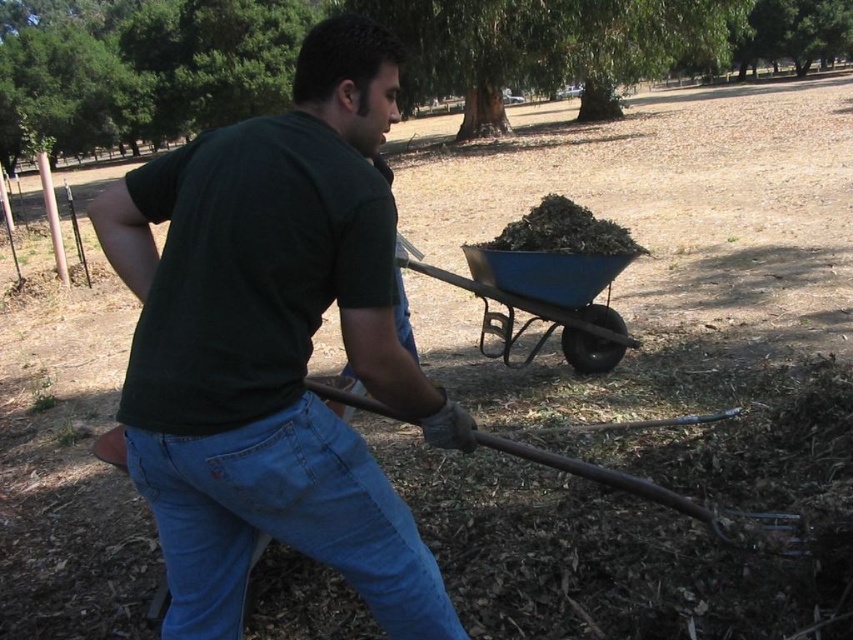
Which is above, denim at left or rusty metal shovel at lower center?

rusty metal shovel at lower center is above.

Identify the location of denim at left. (283, 520).

Is dark green t-shirt at center below rusty metal shovel at lower center?

No, dark green t-shirt at center is not below rusty metal shovel at lower center.

Between dark green t-shirt at center and rusty metal shovel at lower center, which one has more height?

Standing taller between the two is dark green t-shirt at center.

What do you see at coordinates (274, 346) in the screenshot? Image resolution: width=853 pixels, height=640 pixels. I see `dark green t-shirt at center` at bounding box center [274, 346].

The image size is (853, 640). What are the coordinates of `dark green t-shirt at center` in the screenshot? It's located at (274, 346).

Looking at this image, is denim at left taller than blue metal wheelbarrow at center?

Incorrect, denim at left's height is not larger of blue metal wheelbarrow at center's.

Measure the distance between denim at left and camera.

denim at left and camera are 3.47 feet apart from each other.

Does point (265, 449) come behind point (416, 257)?

No.

Identify the location of denim at left. The image size is (853, 640). (283, 520).